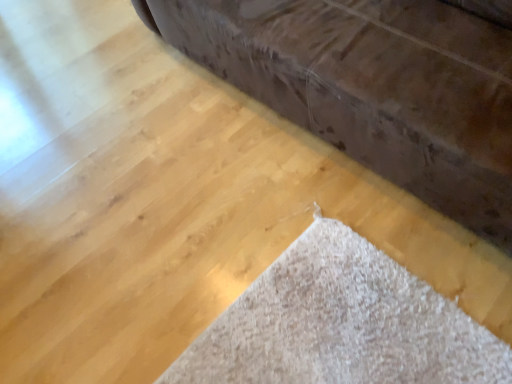
What do you see at coordinates (373, 88) in the screenshot? This screenshot has height=384, width=512. I see `brown leather couch at upper right` at bounding box center [373, 88].

Measure the distance between point (x=494, y=69) and camera.

4.43 feet.

The width and height of the screenshot is (512, 384). Identify the location of brown leather couch at upper right. (373, 88).

Identify the location of brown leather couch at upper right. This screenshot has width=512, height=384. (373, 88).